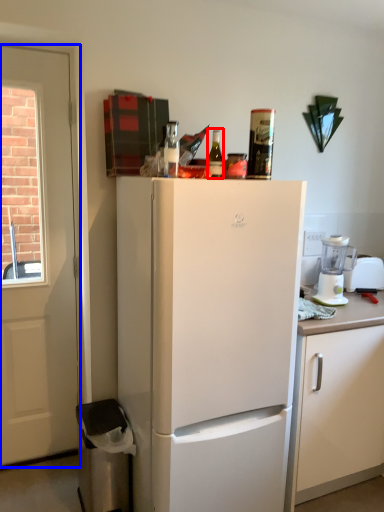
Question: Among these objects, which one is farthest to the camera, bottle (highlighted by a red box) or door (highlighted by a blue box)?

Choices:
 (A) bottle
 (B) door

Answer: (B)